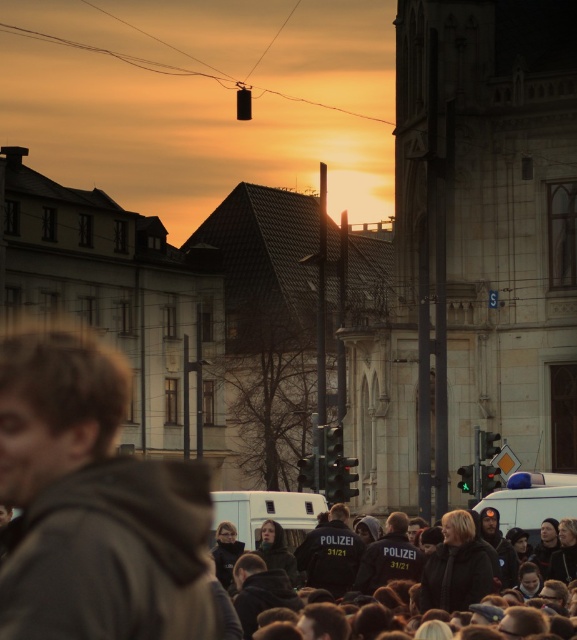
You are a pedestrian in the scene. You see a dark brown hoodie at center and a white matte police van at center. Which object is closer to you?

The dark brown hoodie at center is closer to you because it is positioned over the white matte police van at center.